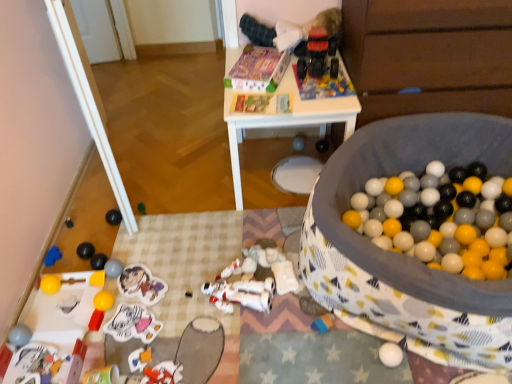
You are a GUI agent. You are given a task and a screenshot of the screen. Output one action in this format:
    pyautogui.click(x=<x>, y=<y>)
    Task: Click on the vacant space behind white matte robot at center, placed as the 7th toy when sorted from right to left
    
    Given the screenshot: What is the action you would take?
    pyautogui.click(x=233, y=245)